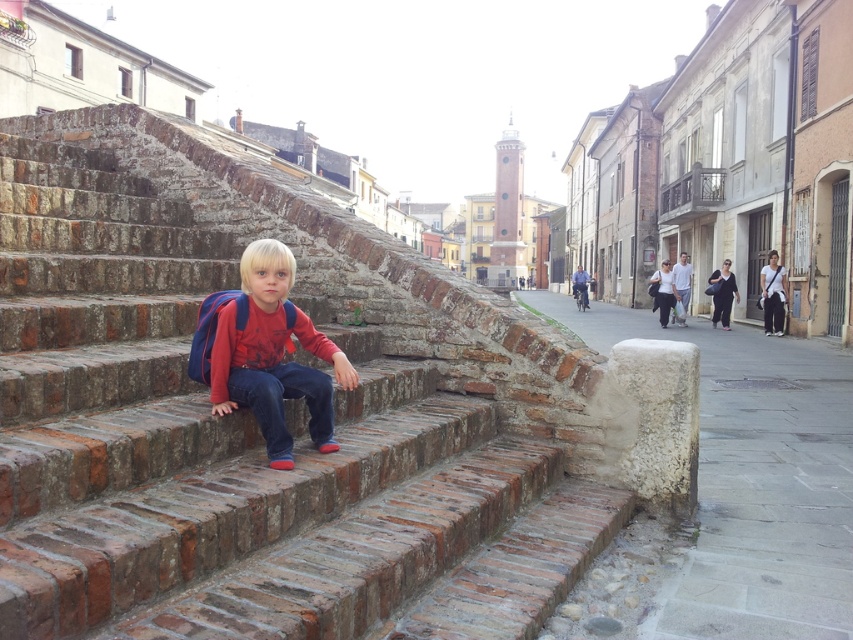
Locate an element on the screen. This screenshot has width=853, height=640. brick stairs at center is located at coordinates (252, 417).

Does brick stairs at center appear under matte red shirt at center?

Correct, brick stairs at center is located below matte red shirt at center.

Describe the element at coordinates (252, 417) in the screenshot. I see `brick stairs at center` at that location.

The width and height of the screenshot is (853, 640). I want to click on brick stairs at center, so click(x=252, y=417).